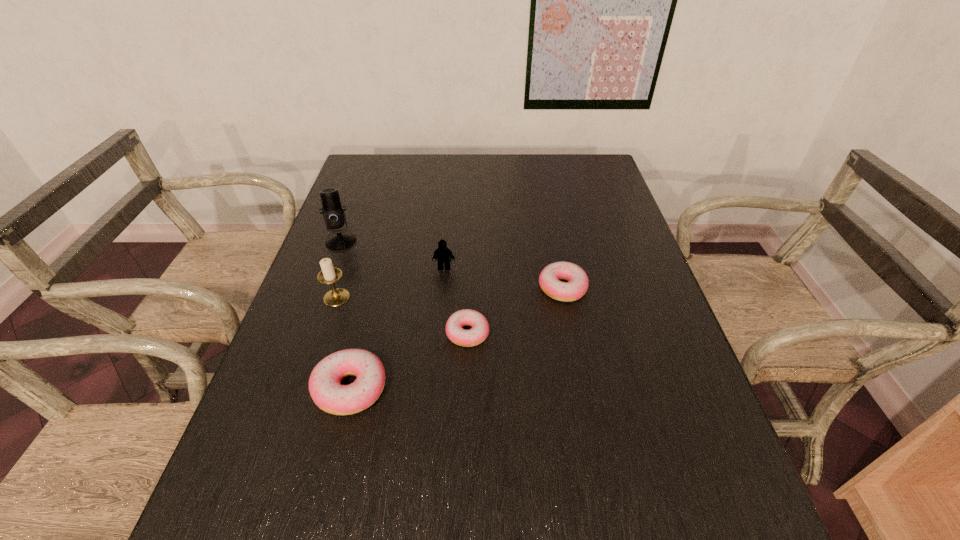
Where is `the tallest doughnut`? The height and width of the screenshot is (540, 960). the tallest doughnut is located at coordinates (329, 395).

Where is `the nearest doughnut`? This screenshot has width=960, height=540. the nearest doughnut is located at coordinates (329, 395).

The width and height of the screenshot is (960, 540). Identify the location of the shortest doughnut. (479, 332).

Where is `the second doughnut from right to left`? the second doughnut from right to left is located at coordinates (479, 332).

Identify the location of the rightmost doughnut. (549, 279).

In order to click on the farthest doughnut in this screenshot , I will do `click(549, 279)`.

Find the location of a particular element. This screenshot has width=960, height=540. candle holder is located at coordinates (337, 296).

The width and height of the screenshot is (960, 540). I want to click on microphone, so click(333, 213).

Find the location of a particular element. The height and width of the screenshot is (540, 960). the farthest object is located at coordinates (x=333, y=213).

This screenshot has width=960, height=540. I want to click on the fourth shortest object, so click(442, 255).